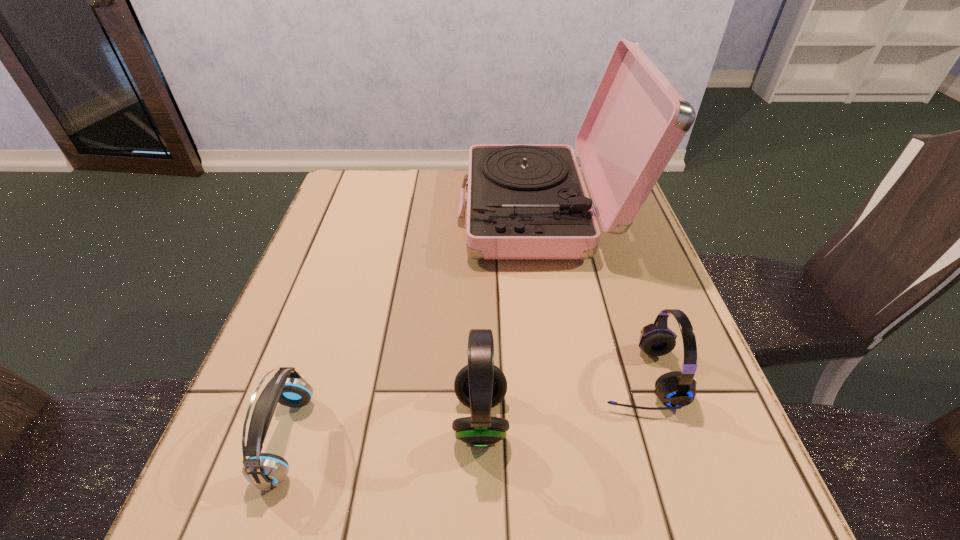
This screenshot has width=960, height=540. I want to click on object that is positioned at the left edge, so click(x=265, y=471).

Locate an element on the screen. The width and height of the screenshot is (960, 540). record player that is at the right edge is located at coordinates (525, 201).

Where is `headset that is at the right edge`? headset that is at the right edge is located at coordinates (675, 389).

Identify the location of object that is at the near left corner. (265, 471).

Locate an element on the screen. This screenshot has width=960, height=540. object that is at the far right corner is located at coordinates (525, 201).

The width and height of the screenshot is (960, 540). Find the location of `vacant region at the far edge of the desktop`. vacant region at the far edge of the desktop is located at coordinates (403, 210).

This screenshot has width=960, height=540. What are the coordinates of `vacant space at the near edge` in the screenshot? It's located at (548, 532).

You are a GUI agent. You are given a task and a screenshot of the screen. Output one action in this format:
    pyautogui.click(x=<x>, y=<y>)
    Task: Click on the vacant space at the left edge
    The height and width of the screenshot is (540, 960).
    Given the screenshot: What is the action you would take?
    (307, 306)

Where is `vacant space at the right edge`? This screenshot has width=960, height=540. vacant space at the right edge is located at coordinates (714, 423).

This screenshot has width=960, height=540. Identify the location of vacant space at the far left corner of the desktop. (396, 178).